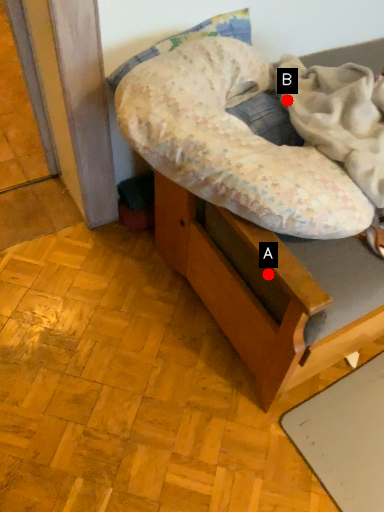
Question: Two points are circled on the image, labeled by A and B beside each circle. Among these points, which one is nearest to the camera?

Choices:
 (A) A is closer
 (B) B is closer

Answer: (A)